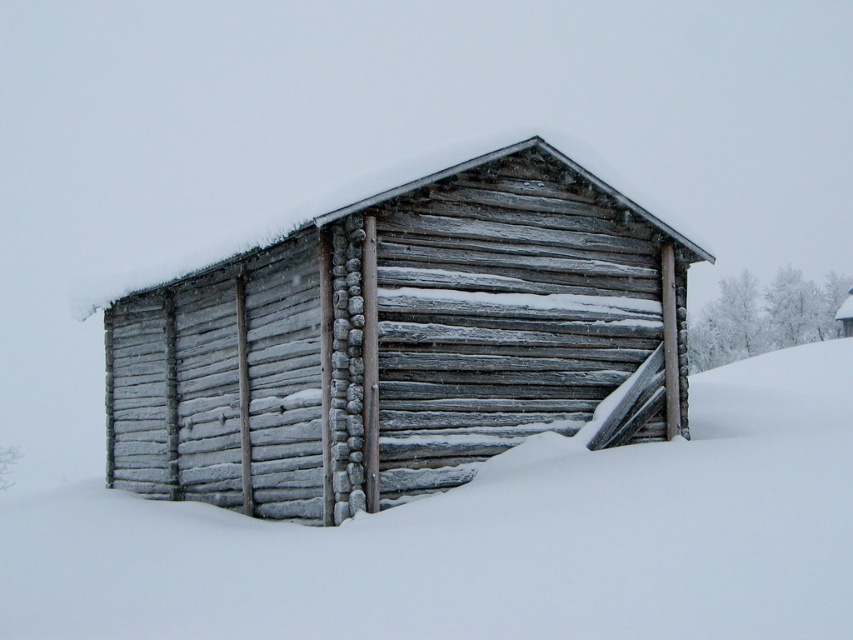
Question: Is gray wooden cabin at center below white frosty snow at center?

Choices:
 (A) yes
 (B) no

Answer: (B)

Question: Is gray wooden cabin at center behind white frosty snow at center?

Choices:
 (A) yes
 (B) no

Answer: (A)

Question: Does gray wooden cabin at center lie behind white frosty snow at center?

Choices:
 (A) yes
 (B) no

Answer: (A)

Question: Which of the following is the closest to the observer?

Choices:
 (A) (428, 628)
 (B) (491, 321)

Answer: (A)

Question: Which of the following is the farthest from the observer?

Choices:
 (A) (556, 573)
 (B) (219, 419)

Answer: (B)

Question: Which of the following is the farthest from the observer?

Choices:
 (A) gray wooden cabin at center
 (B) white frosty snow at center

Answer: (A)